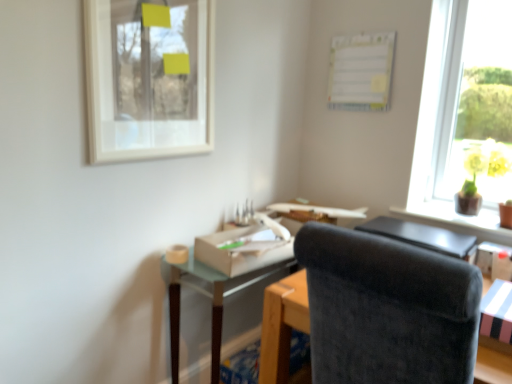
The image size is (512, 384). Find the location of `free spot above white cardboard box at lower right, arranged as the 2th cardboard box when viewed from the left (from a real-world perspective)`. free spot above white cardboard box at lower right, arranged as the 2th cardboard box when viewed from the left (from a real-world perspective) is located at coordinates (502, 297).